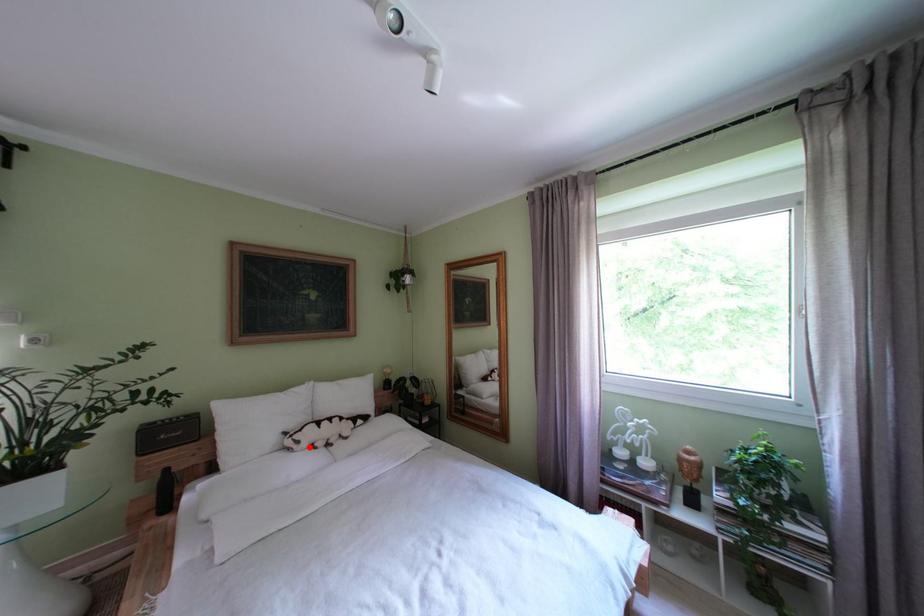
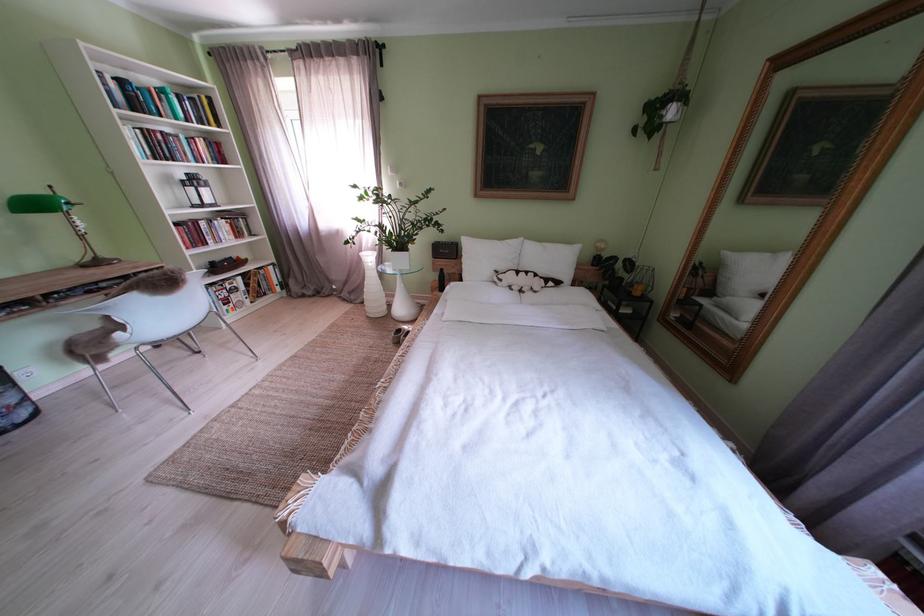
Find the pixel in the second image that matches the highlighted location in the first image.

(512, 285)